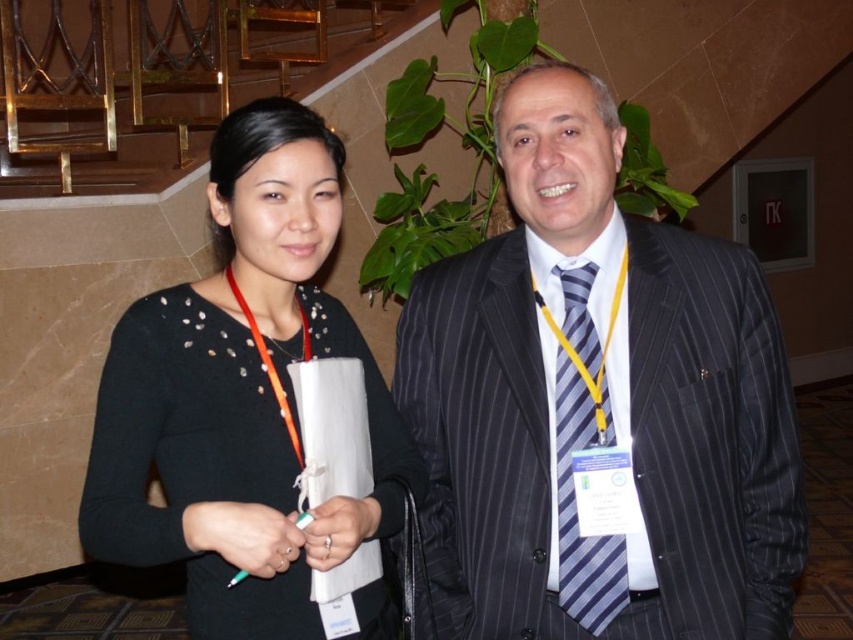
Question: Can you confirm if striped fabric suit at center is wider than black matte sweater at center?

Choices:
 (A) yes
 (B) no

Answer: (A)

Question: Considering the real-world distances, which object is closest to the black matte sweater at center?

Choices:
 (A) striped fabric suit at center
 (B) blue striped tie at center

Answer: (A)

Question: Is black matte sweater at center closer to the viewer compared to blue striped tie at center?

Choices:
 (A) no
 (B) yes

Answer: (B)

Question: Does striped fabric suit at center appear over black matte sweater at center?

Choices:
 (A) yes
 (B) no

Answer: (A)

Question: Which point is farther to the camera?

Choices:
 (A) blue striped tie at center
 (B) black matte sweater at center
 (C) striped fabric suit at center

Answer: (A)

Question: Which object is the closest to the striped fabric suit at center?

Choices:
 (A) blue striped tie at center
 (B) black matte sweater at center

Answer: (A)